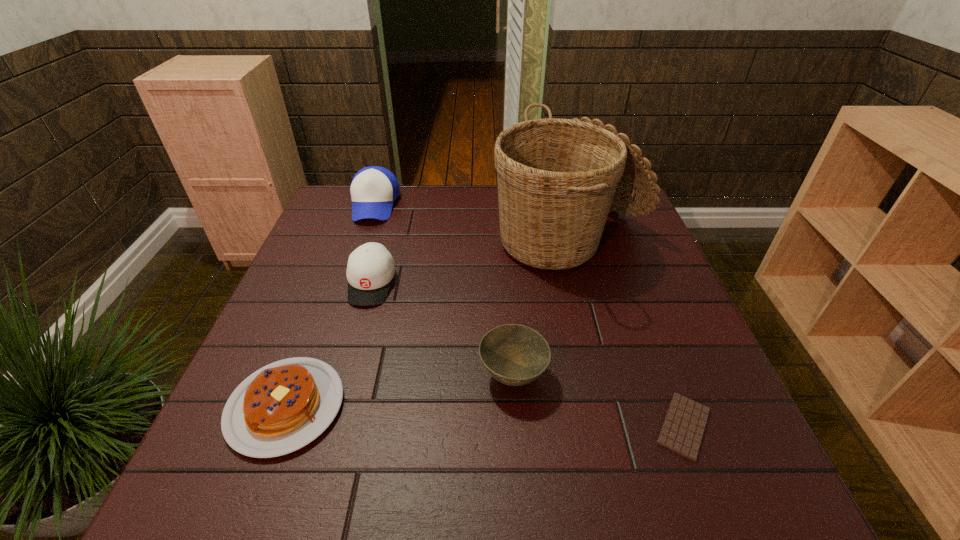
At what (x,y) coordinates should I click in order to perform the action: click on object that is at the near left corner. Please return your answer as a coordinate pair (x, y). The width and height of the screenshot is (960, 540). Looking at the image, I should click on (283, 406).

This screenshot has width=960, height=540. Find the location of `object that is at the far right corner`. object that is at the far right corner is located at coordinates (557, 178).

This screenshot has height=540, width=960. I want to click on object that is at the near right corner, so click(684, 425).

This screenshot has height=540, width=960. Identify the location of free space at the far edge of the desktop. (451, 200).

This screenshot has width=960, height=540. Identify the location of vacant space at the near edge of the desktop. (635, 504).

I want to click on vacant region at the left edge, so click(266, 322).

You are a GUI agent. You are given a task and a screenshot of the screen. Output one action in this format:
    pyautogui.click(x=<x>, y=<y>)
    Task: Click on the free space at the right edge of the desktop
    Image resolution: width=960 pixels, height=540 pixels.
    Given the screenshot: What is the action you would take?
    pyautogui.click(x=685, y=355)

The width and height of the screenshot is (960, 540). Find the location of `free space between the bowl and the shortest object`. free space between the bowl and the shortest object is located at coordinates (598, 401).

Find the location of `vacant space that is in between the farther baseball cap and the chocolate bar`. vacant space that is in between the farther baseball cap and the chocolate bar is located at coordinates (529, 315).

Identify the location of empty space between the farther baseball cap and the tallest object. This screenshot has width=960, height=540. (472, 222).